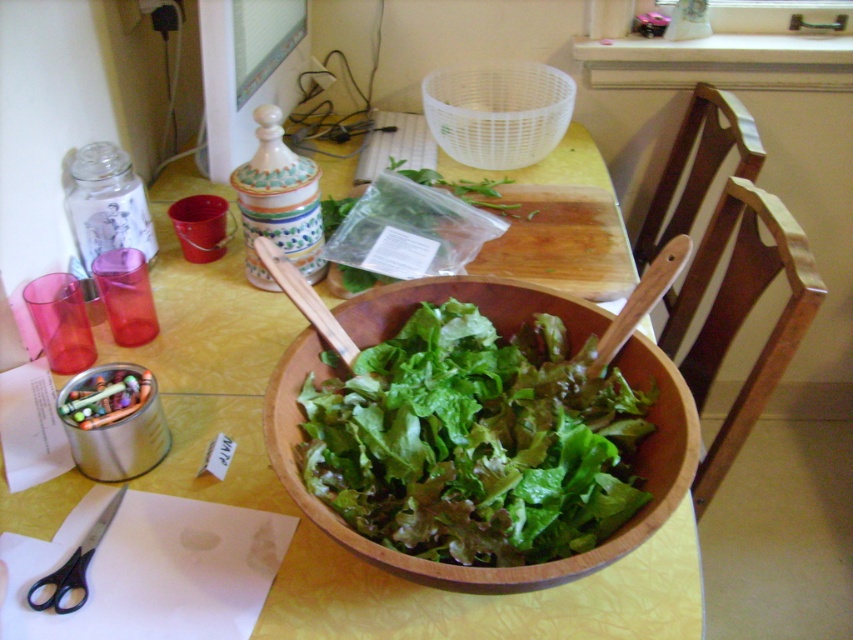
Question: Which object is positioned farthest from the black plastic scissors at lower left?

Choices:
 (A) metallic crayons at left
 (B) transparent plastic basket at upper center
 (C) wooden salad bowl at center

Answer: (B)

Question: Does wooden salad bowl at center have a smaller size compared to translucent plastic bag at center?

Choices:
 (A) no
 (B) yes

Answer: (A)

Question: Is wooden bowl at center wider than transparent plastic basket at upper center?

Choices:
 (A) no
 (B) yes

Answer: (B)

Question: Considering the real-world distances, which object is farthest from the transparent plastic basket at upper center?

Choices:
 (A) translucent plastic bag at center
 (B) black plastic scissors at lower left
 (C) wooden salad bowl at center
 (D) metallic crayons at left

Answer: (B)

Question: Does wooden bowl at center have a larger size compared to transparent plastic basket at upper center?

Choices:
 (A) no
 (B) yes

Answer: (B)

Question: Which point appears closest to the camera in this image?

Choices:
 (A) (415, 566)
 (B) (405, 243)
 (C) (73, 406)
 (D) (57, 596)

Answer: (A)